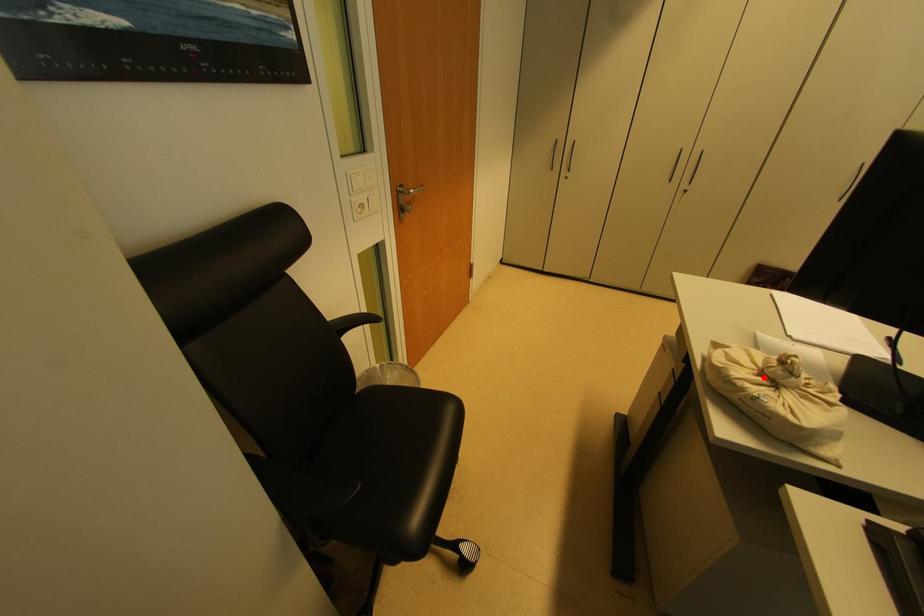
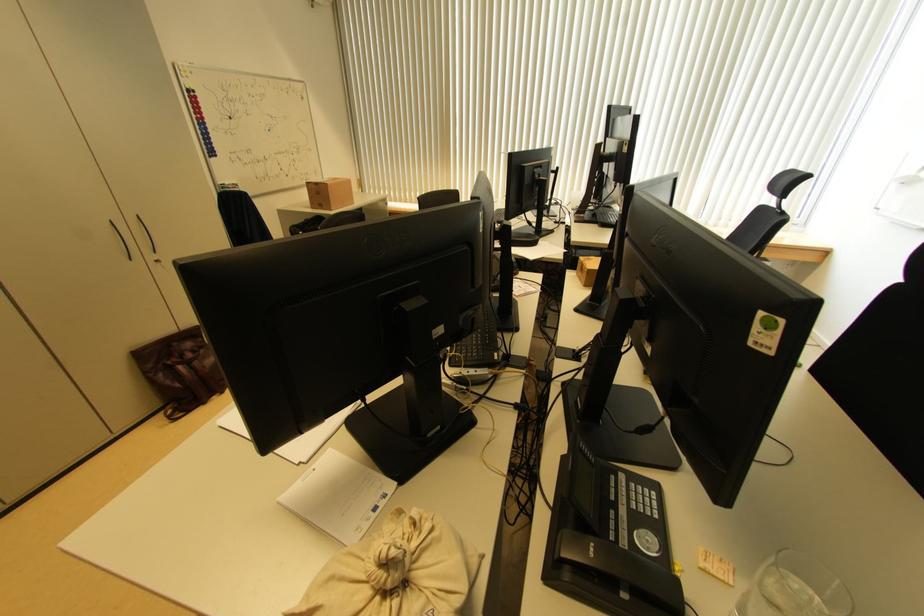
Locate, in the second image, the point that corresponds to the highlighted location in the first image.

(387, 597)